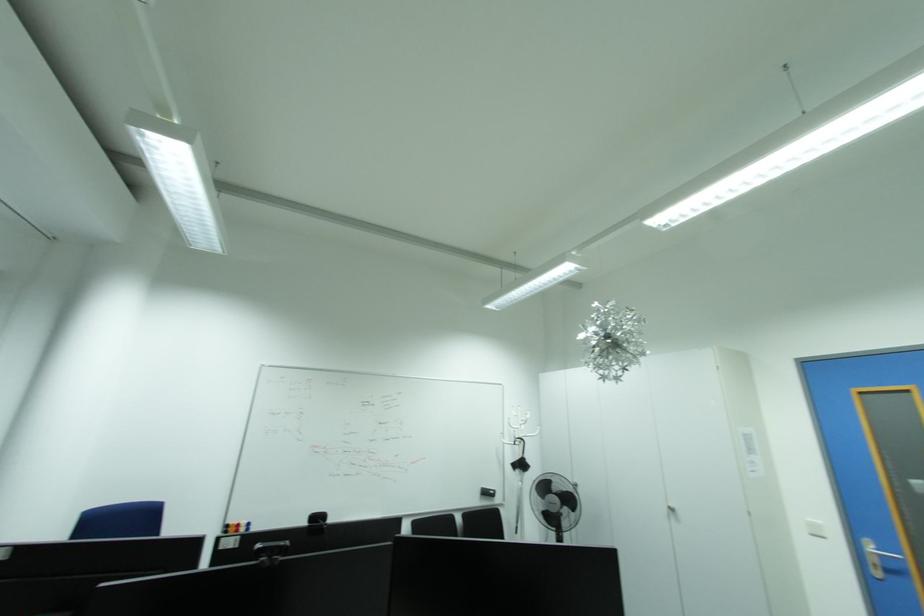
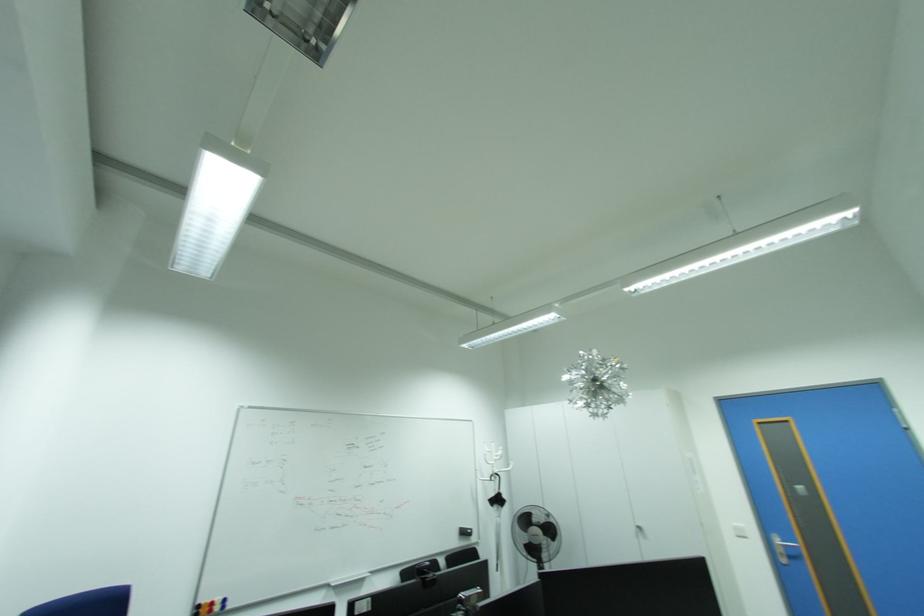
Question: In a continuous first-person perspective shot, in which direction is the camera moving?

Choices:
 (A) Left
 (B) Right
 (C) Forward
 (D) Backward

Answer: (A)